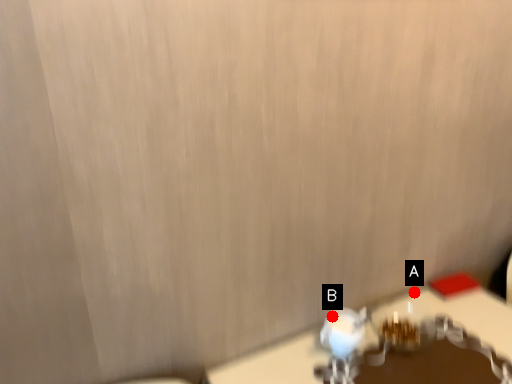
Question: Two points are circled on the image, labeled by A and B beside each circle. Which point is closer to the camera?

Choices:
 (A) A is closer
 (B) B is closer

Answer: (B)